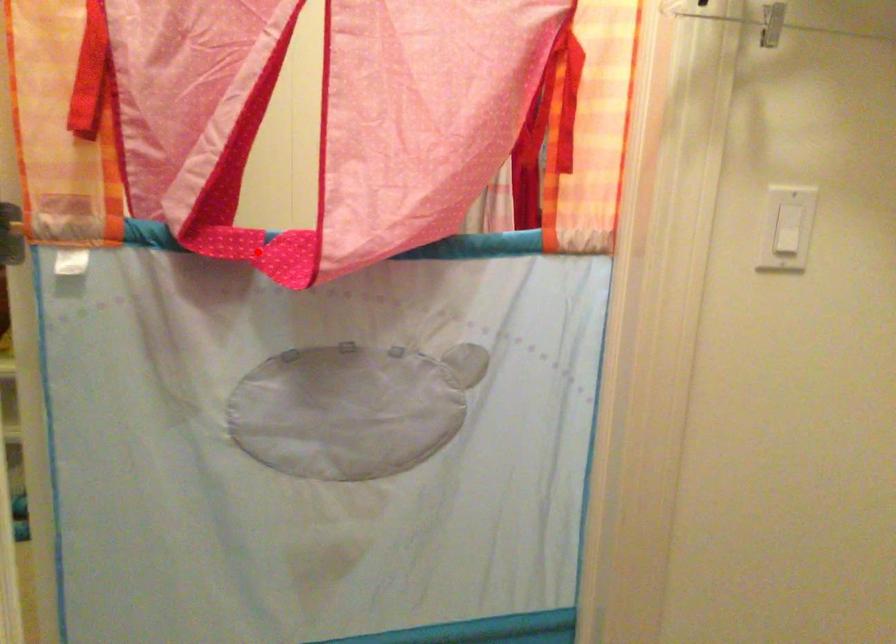
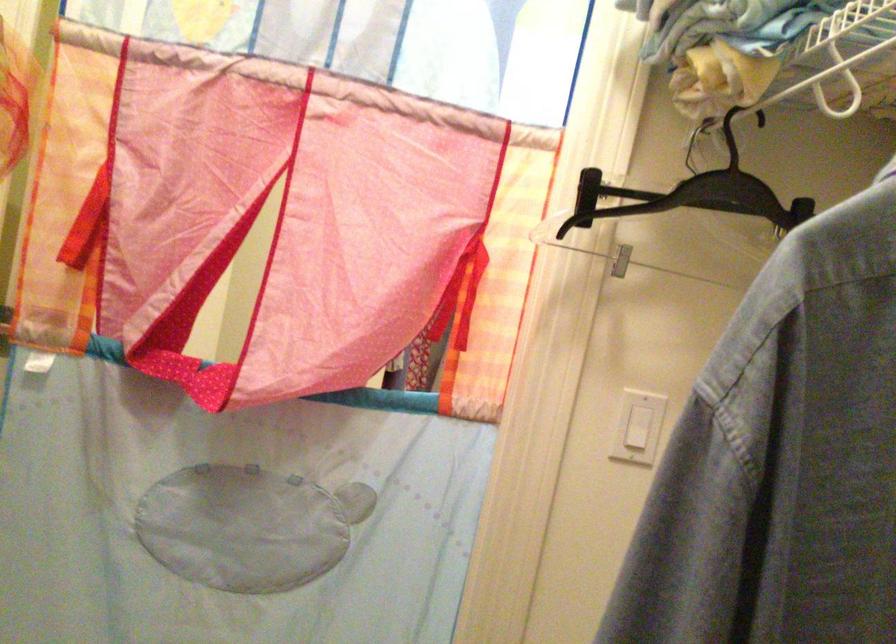
In the second image, find the point that corresponds to the highlighted location in the first image.

(188, 375)